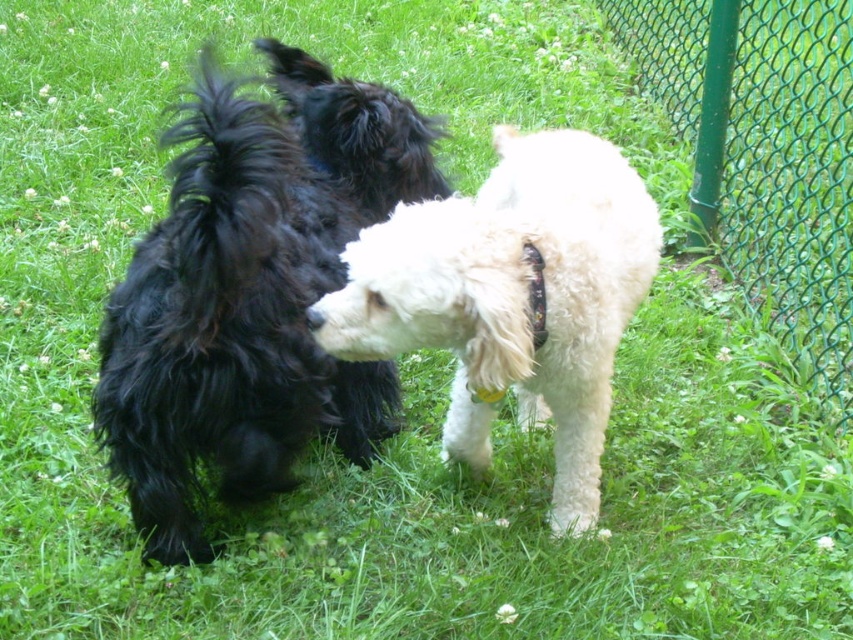
You are a photographer trying to capture a photo of the shiny black fur at center and the green wire mesh fence at right. Which object should you focus on first if you want to ensure both are in focus without adjusting the camera settings?

The shiny black fur at center should be focused on first because it is closer to the camera than the green wire mesh fence at right.

Looking at this image, you are a photographer trying to capture a closeup shot of both the shiny black fur at center and the white fluffy dog at center. Given that your camera can only focus on objects within a 15 inch range, will you be able to get both subjects in focus?

The shiny black fur at center and the white fluffy dog at center are 15.82 inches apart from each other. Since the distance between them exceeds the camera focus range of 15 inches, you won 039 t be able to get both subjects in focus.